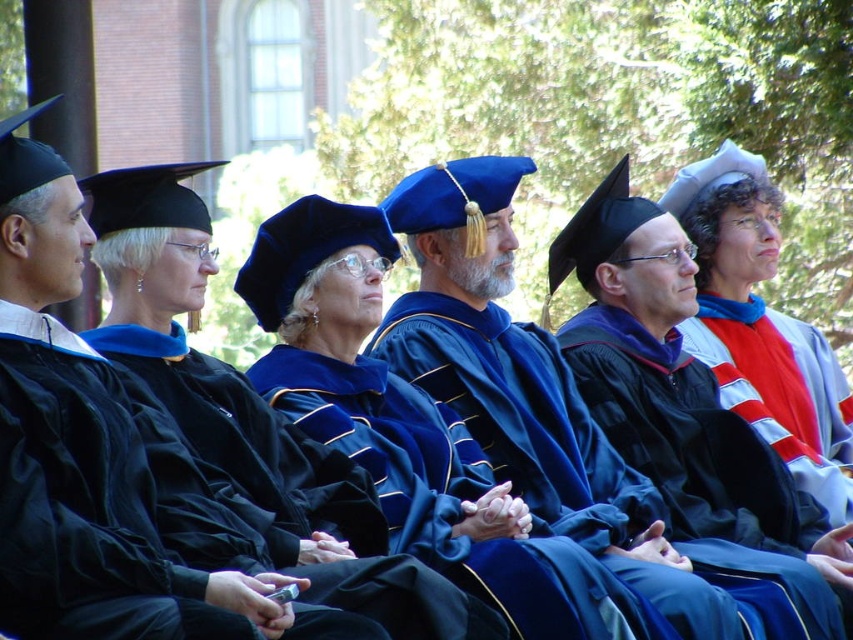
Who is more distant from viewer, (219,397) or (361,406)?

Positioned behind is point (361,406).

Who is taller, matte black gown at center or velvet blue gown at center?

matte black gown at center is taller.

This screenshot has height=640, width=853. In order to click on matte black gown at center in this screenshot , I will do (283, 484).

Where is `matte black gown at center`? Image resolution: width=853 pixels, height=640 pixels. matte black gown at center is located at coordinates (283, 484).

Who is more forward, (105, 502) or (410, 483)?

Point (105, 502) is more forward.

Can you confirm if velvet blue graduation gown at center is smaller than velvet blue gown at center?

No.

The height and width of the screenshot is (640, 853). I want to click on velvet blue graduation gown at center, so click(94, 461).

Who is higher up, velvet blue graduation gown at center or matte black graduation gown at center?

velvet blue graduation gown at center is higher up.

Does velvet blue graduation gown at center have a greater height compared to matte black graduation gown at center?

Incorrect, velvet blue graduation gown at center's height is not larger of matte black graduation gown at center's.

Who is more forward, (x=64, y=406) or (x=730, y=461)?

Point (x=64, y=406) is more forward.

The width and height of the screenshot is (853, 640). What are the coordinates of `velvet blue graduation gown at center` in the screenshot? It's located at (94, 461).